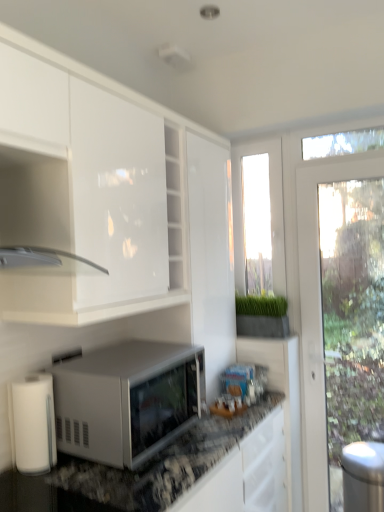
Image resolution: width=384 pixels, height=512 pixels. Identify the location of vacant space situated above white matte microwave at center (from a real-world perspective). (120, 350).